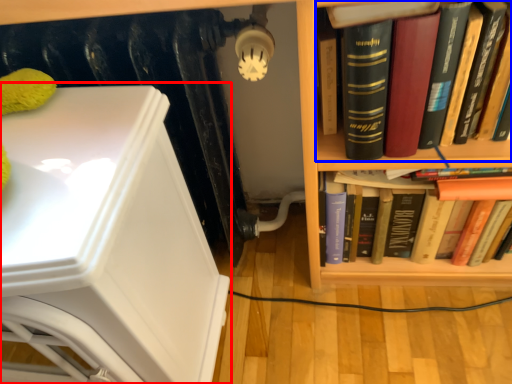
Question: Which object appears farthest to the camera in this image, armchair (highlighted by a red box) or book (highlighted by a blue box)?

Choices:
 (A) armchair
 (B) book

Answer: (B)